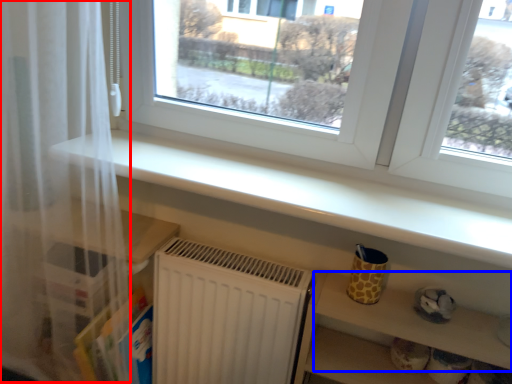
Question: Which of the following is the closest to the observer, curtain (highlighted by a red box) or shelf (highlighted by a blue box)?

Choices:
 (A) curtain
 (B) shelf

Answer: (A)